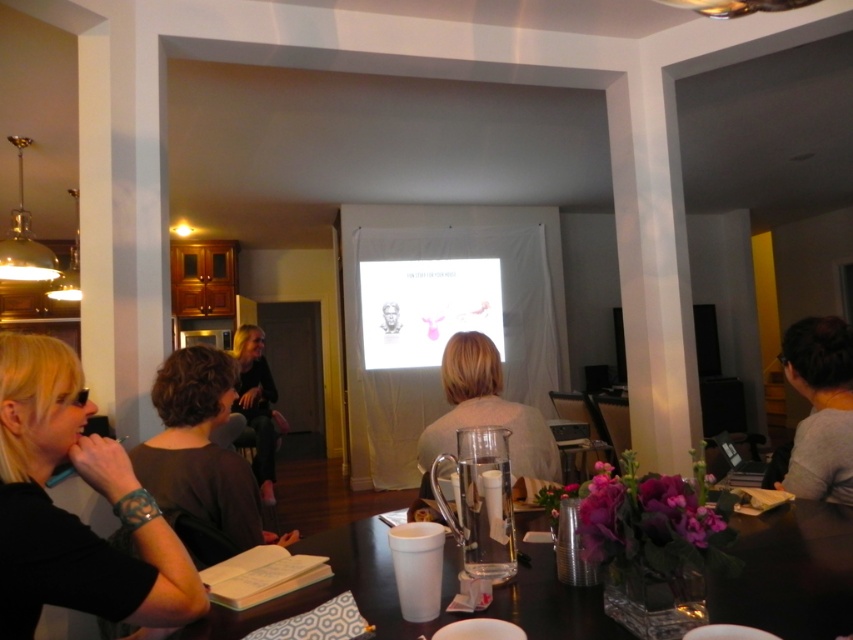
Does black matte hair at left have a lesser width compared to translucent glass table at center?

Correct, black matte hair at left's width is less than translucent glass table at center's.

Does black matte hair at left appear over translucent glass table at center?

Yes.

This screenshot has height=640, width=853. What are the coordinates of `black matte hair at left` in the screenshot? It's located at (73, 515).

You are a GUI agent. You are given a task and a screenshot of the screen. Output one action in this format:
    pyautogui.click(x=<x>, y=<y>)
    Task: Click on the black matte hair at left
    The height and width of the screenshot is (640, 853).
    Given the screenshot: What is the action you would take?
    pyautogui.click(x=73, y=515)

Can you confirm if black matte hair at left is bigger than gray matte shirt at lower right?

Incorrect, black matte hair at left is not larger than gray matte shirt at lower right.

From the picture: Which is below, black matte hair at left or gray matte shirt at lower right?

black matte hair at left

Is point (18, 632) more distant than point (844, 456)?

No.

Where is `black matte hair at left`? black matte hair at left is located at coordinates (73, 515).

Is point (212, 365) positioned behind point (259, 394)?

No, it is in front of (259, 394).

Is dark brown hair at lower left above black fabric jacket at center?

Correct, dark brown hair at lower left is located above black fabric jacket at center.

At what (x,y) coordinates should I click in order to perform the action: click on dark brown hair at lower left. Please return your answer as a coordinate pair (x, y). Looking at the image, I should click on (200, 460).